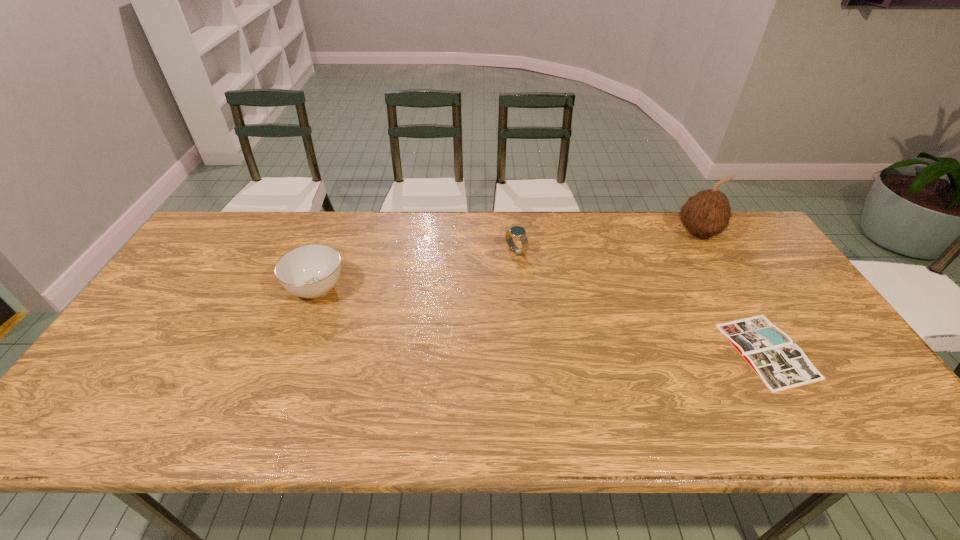
I want to click on the tallest object, so click(x=707, y=213).

Locate an element on the screen. chinaware is located at coordinates (310, 271).

I want to click on the third farthest object, so pos(310,271).

Image resolution: width=960 pixels, height=540 pixels. I want to click on watch, so click(519, 232).

You are a GUI agent. You are given a task and a screenshot of the screen. Output one action in this format:
    pyautogui.click(x=<x>, y=<y>)
    Task: Click on the third tallest object
    Image resolution: width=960 pixels, height=540 pixels.
    Given the screenshot: What is the action you would take?
    pyautogui.click(x=519, y=232)

Locate an element on the screen. Image resolution: width=960 pixels, height=540 pixels. the shortest object is located at coordinates (781, 365).

What are the coordinates of `book` in the screenshot? It's located at (781, 365).

Where is `vacant area located on the surface of the tallest object`? The width and height of the screenshot is (960, 540). vacant area located on the surface of the tallest object is located at coordinates (742, 308).

Where is `vacant position located on the back of the third shortest object`? vacant position located on the back of the third shortest object is located at coordinates (335, 240).

Locate an element on the screen. The image size is (960, 540). vacant area situated on the left of the second shortest object is located at coordinates (432, 251).